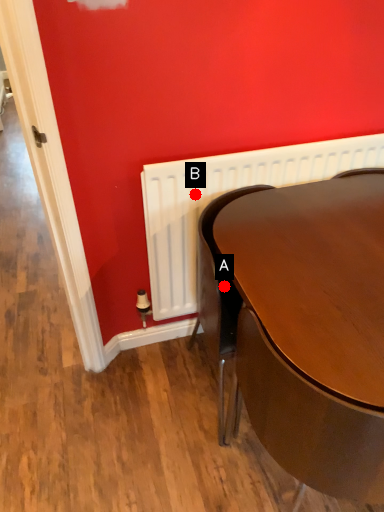
Question: Two points are circled on the image, labeled by A and B beside each circle. Which point is closer to the camera taking this photo?

Choices:
 (A) A is closer
 (B) B is closer

Answer: (A)